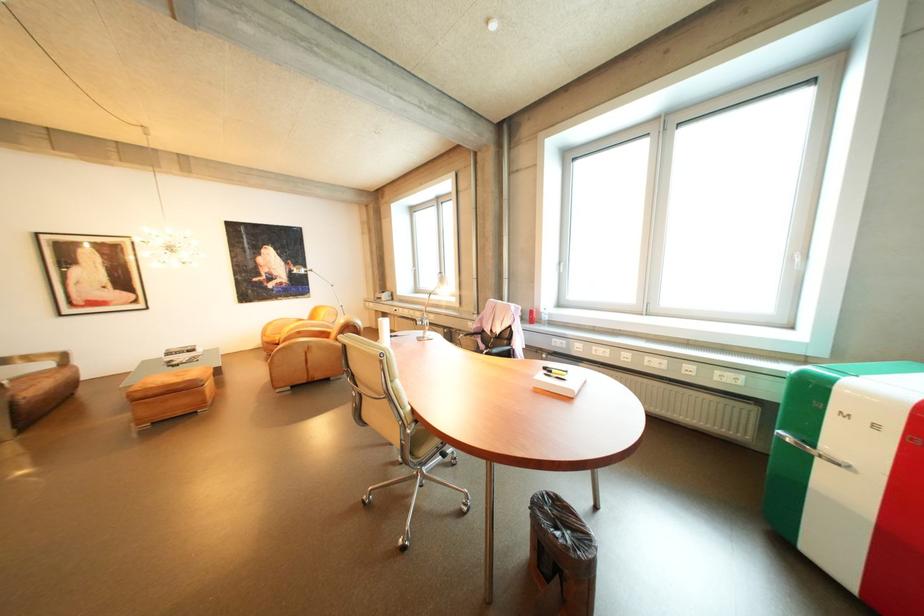
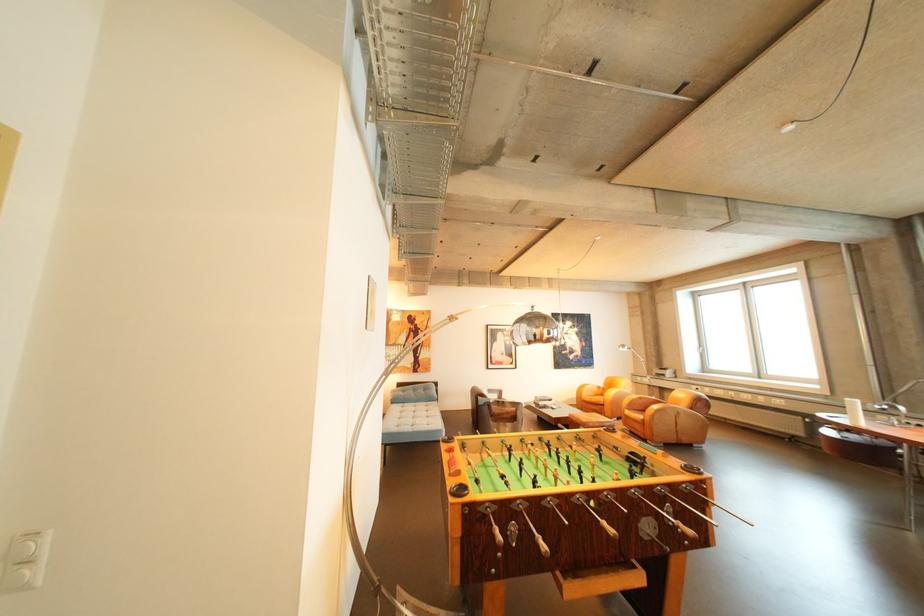
The point at (282, 334) is marked in the first image. Where is the corresponding point in the second image?

(598, 395)